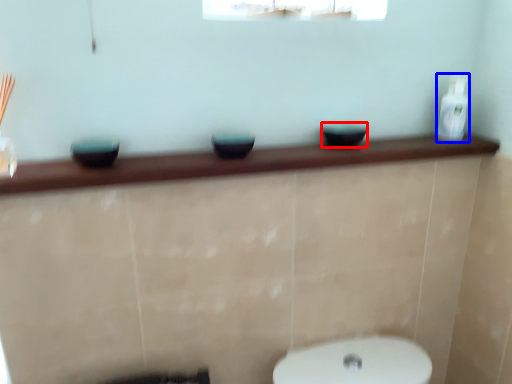
Question: Which object appears farthest to the camera in this image, basin (highlighted by a red box) or toiletry (highlighted by a blue box)?

Choices:
 (A) basin
 (B) toiletry

Answer: (B)